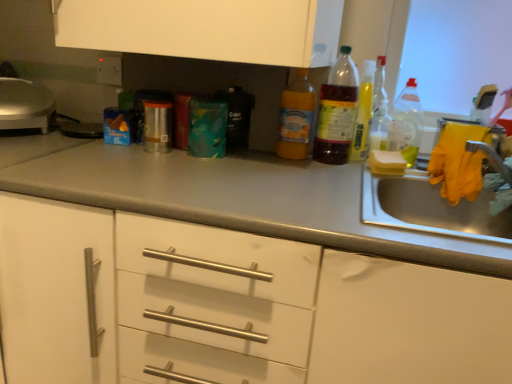
The height and width of the screenshot is (384, 512). Find the location of `vacant region in front of translucent plastic bottle at upper right, arranged as the third bottle when viewed from the right`. vacant region in front of translucent plastic bottle at upper right, arranged as the third bottle when viewed from the right is located at coordinates (349, 166).